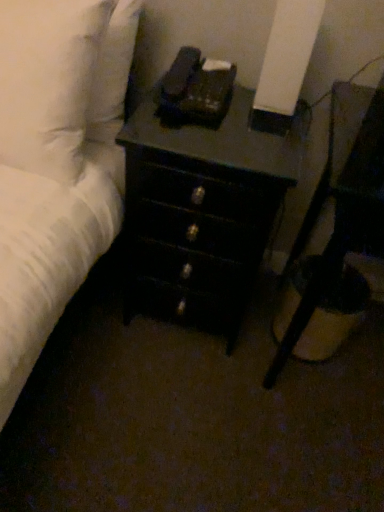
Question: Is the depth of black glossy nightstand at lower right greater than that of white soft pillow at upper left?

Choices:
 (A) yes
 (B) no

Answer: (B)

Question: Does black glossy nightstand at lower right have a larger size compared to white soft pillow at upper left?

Choices:
 (A) no
 (B) yes

Answer: (B)

Question: Is black glossy nightstand at lower right located outside white soft pillow at upper left?

Choices:
 (A) yes
 (B) no

Answer: (A)

Question: Does black glossy nightstand at lower right appear on the right side of white soft pillow at upper left?

Choices:
 (A) yes
 (B) no

Answer: (A)

Question: Is the depth of black glossy nightstand at lower right less than that of white soft pillow at upper left?

Choices:
 (A) yes
 (B) no

Answer: (A)

Question: Does point (140, 159) appear closer or farther from the camera than point (365, 168)?

Choices:
 (A) farther
 (B) closer

Answer: (A)

Question: Based on their positions, is black wood chest of drawers at center located to the left or right of black glossy nightstand at lower right?

Choices:
 (A) left
 (B) right

Answer: (A)

Question: Considering the positions of black wood chest of drawers at center and black glossy nightstand at lower right in the image, is black wood chest of drawers at center wider or thinner than black glossy nightstand at lower right?

Choices:
 (A) wide
 (B) thin

Answer: (B)

Question: In terms of height, does black wood chest of drawers at center look taller or shorter compared to black glossy nightstand at lower right?

Choices:
 (A) short
 (B) tall

Answer: (A)

Question: From the image's perspective, is black wood chest of drawers at center located above or below white soft pillow at upper left?

Choices:
 (A) below
 (B) above

Answer: (A)

Question: Is black wood chest of drawers at center bigger or smaller than white soft pillow at upper left?

Choices:
 (A) big
 (B) small

Answer: (A)

Question: Considering the relative positions of black wood chest of drawers at center and white soft pillow at upper left in the image provided, is black wood chest of drawers at center to the left or to the right of white soft pillow at upper left?

Choices:
 (A) left
 (B) right

Answer: (B)

Question: In terms of width, does black wood chest of drawers at center look wider or thinner when compared to white soft pillow at upper left?

Choices:
 (A) wide
 (B) thin

Answer: (A)

Question: Considering the positions of white soft pillow at upper left and black wood chest of drawers at center in the image, is white soft pillow at upper left wider or thinner than black wood chest of drawers at center?

Choices:
 (A) wide
 (B) thin

Answer: (B)

Question: Does point (14, 39) appear closer or farther from the camera than point (187, 196)?

Choices:
 (A) farther
 (B) closer

Answer: (B)